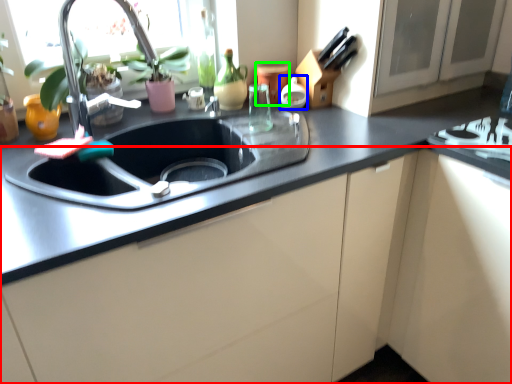
Question: Considering the real-world distances, which object is closest to cabinetry (highlighted by a red box)? appliance (highlighted by a blue box) or appliance (highlighted by a green box).

Choices:
 (A) appliance
 (B) appliance

Answer: (A)